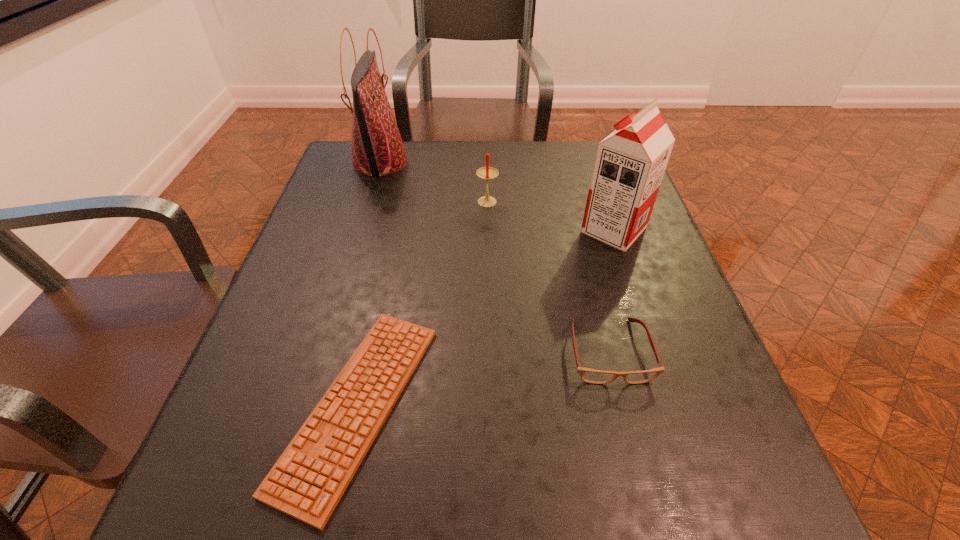
You are a GUI agent. You are given a task and a screenshot of the screen. Output one action in this format:
    pyautogui.click(x=<x>, y=<y>)
    Task: Click on the free region at the near edge of the desktop
    Image resolution: width=960 pixels, height=540 pixels.
    Given the screenshot: What is the action you would take?
    pyautogui.click(x=342, y=514)

The height and width of the screenshot is (540, 960). I want to click on free space at the left edge, so click(305, 392).

Find the location of a particular element. The width and height of the screenshot is (960, 540). blank space at the right edge of the desktop is located at coordinates (742, 419).

In the image, there is a desktop. At what (x,y) coordinates should I click in order to perform the action: click on free space at the far left corner. Please return your answer as a coordinate pair (x, y). Image resolution: width=960 pixels, height=540 pixels. Looking at the image, I should click on (329, 181).

Where is `vacant region at the far right corner of the desktop`? This screenshot has width=960, height=540. vacant region at the far right corner of the desktop is located at coordinates (569, 147).

In the image, there is a desktop. Where is `blank space at the near right corner`? The width and height of the screenshot is (960, 540). blank space at the near right corner is located at coordinates (664, 487).

At what (x,y) coordinates should I click in order to perform the action: click on empty location between the shortest object and the fourth shortest object. Please return your answer as a coordinate pair (x, y). The height and width of the screenshot is (540, 960). Looking at the image, I should click on (486, 317).

Identify the location of free space between the third shortest object and the fourth tallest object. (548, 278).

This screenshot has width=960, height=540. Find the location of `vacant point located between the fourth tallest object and the fourth shortest object`. vacant point located between the fourth tallest object and the fourth shortest object is located at coordinates (612, 291).

This screenshot has width=960, height=540. What are the coordinates of `blank region between the soya milk and the second shortest object` in the screenshot? It's located at (612, 291).